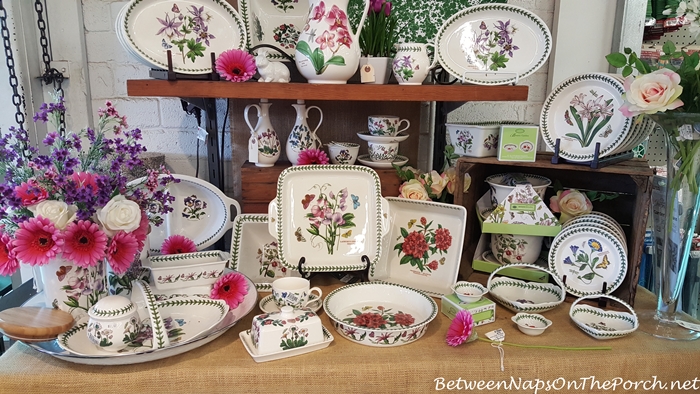
This screenshot has height=394, width=700. In order to click on black hanging flower pot chains in this screenshot , I will do `click(40, 20)`, `click(15, 88)`.